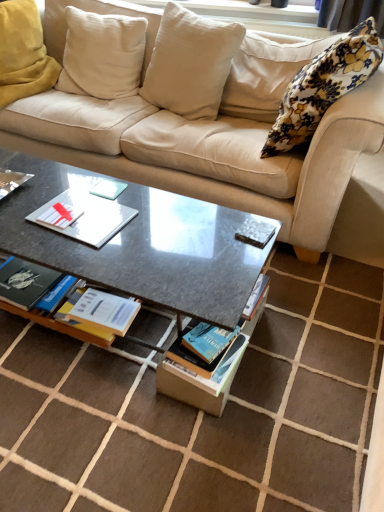
What are the coordinates of `vacant space that's between metallic silver magazine at center, the 2th magazine ordered from the bottom, and white matte paper at center` in the screenshot? It's located at (174, 230).